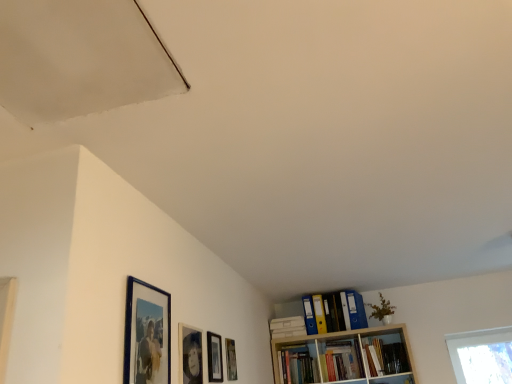
Question: Are hardcover book at upper right, which is the 1th book from right to left, and matte black picture frame at center, placed as the third picture frame when sorted from front to back, making contact?

Choices:
 (A) yes
 (B) no

Answer: (B)

Question: Can you confirm if hardcover book at upper right, which is the 1th book from right to left, is positioned to the left of matte black picture frame at center, which is counted as the 2th picture frame, starting from the right?

Choices:
 (A) yes
 (B) no

Answer: (B)

Question: Can you confirm if hardcover book at upper right, marked as the 2th book in a left-to-right arrangement, is bigger than matte black picture frame at center, placed as the second picture frame when sorted from back to front?

Choices:
 (A) no
 (B) yes

Answer: (B)

Question: Is there a large distance between hardcover book at upper right, marked as the 2th book in a left-to-right arrangement, and matte black picture frame at center, placed as the third picture frame when sorted from front to back?

Choices:
 (A) no
 (B) yes

Answer: (B)

Question: Does hardcover book at upper right, marked as the 2th book in a left-to-right arrangement, have a greater height compared to matte black picture frame at center, which is counted as the 2th picture frame, starting from the right?

Choices:
 (A) yes
 (B) no

Answer: (A)

Question: From the image's perspective, is hardcover book at upper right, which is the 1th book from right to left, on top of matte black picture frame at center, which is counted as the 2th picture frame, starting from the right?

Choices:
 (A) no
 (B) yes

Answer: (A)

Question: Is yellow file folder at upper right, marked as the 2th book in a right-to-left arrangement, turned away from matte wooden picture frame at lower center, which ranks as the first picture frame in back-to-front order?

Choices:
 (A) yes
 (B) no

Answer: (B)

Question: From the image's perspective, is yellow file folder at upper right, placed as the 1th book when sorted from left to right, above matte wooden picture frame at lower center, marked as the 4th picture frame in a left-to-right arrangement?

Choices:
 (A) yes
 (B) no

Answer: (B)

Question: From a real-world perspective, is yellow file folder at upper right, marked as the 2th book in a right-to-left arrangement, below matte wooden picture frame at lower center, the 4th picture frame viewed from the front?

Choices:
 (A) no
 (B) yes

Answer: (A)

Question: Does yellow file folder at upper right, marked as the 2th book in a right-to-left arrangement, appear on the left side of matte wooden picture frame at lower center, the 4th picture frame viewed from the front?

Choices:
 (A) no
 (B) yes

Answer: (A)

Question: Is yellow file folder at upper right, placed as the 1th book when sorted from left to right, aimed at matte wooden picture frame at lower center, marked as the 4th picture frame in a left-to-right arrangement?

Choices:
 (A) yes
 (B) no

Answer: (A)

Question: Is yellow file folder at upper right, marked as the 2th book in a right-to-left arrangement, positioned in front of matte wooden picture frame at lower center, the 4th picture frame viewed from the front?

Choices:
 (A) no
 (B) yes

Answer: (A)

Question: From the image's perspective, is matte black picture frame at center, the 3th picture frame from the left, below blue glossy picture frame at upper left, the fourth picture frame in the back-to-front sequence?

Choices:
 (A) yes
 (B) no

Answer: (A)